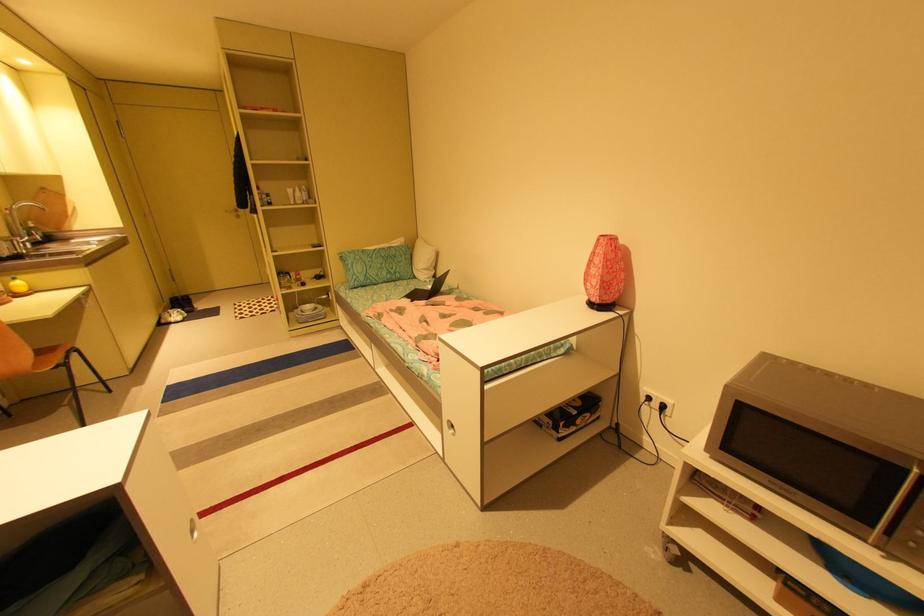
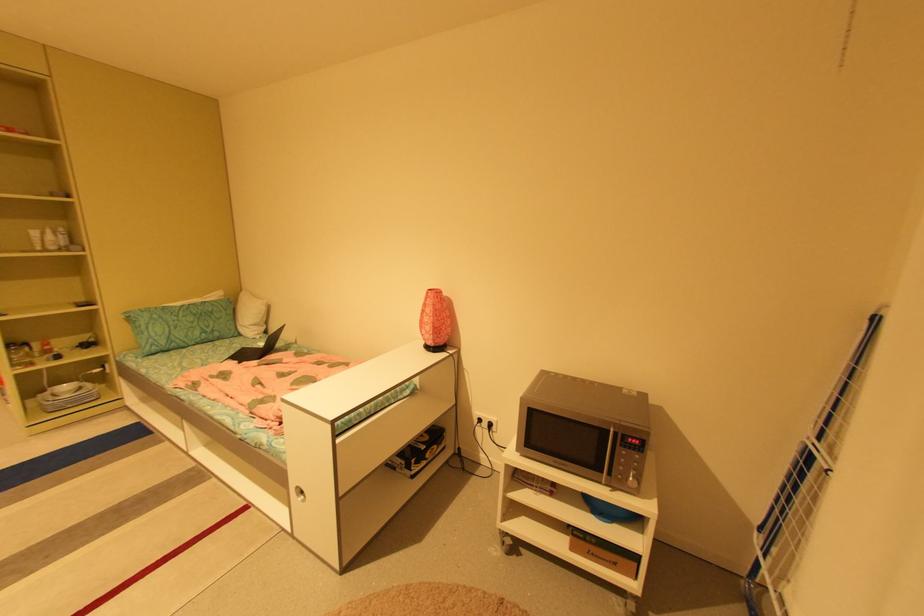
Question: The camera is either moving clockwise (left) or counter-clockwise (right) around the object. The first image is from the beginning of the video and the second image is from the end. Is the camera moving left or right when shooting the video?

Choices:
 (A) Left
 (B) Right

Answer: (A)